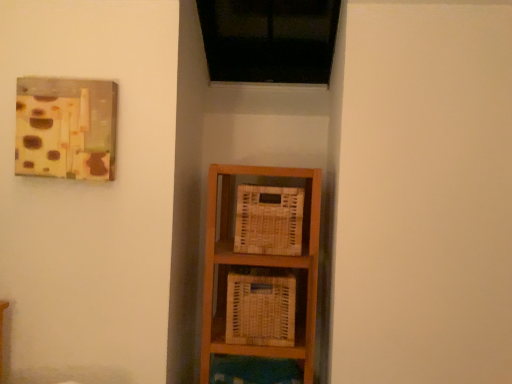
Question: Which direction should I rotate to face woven wood basket at center, placed as the second basket when sorted from bottom to top, — up or down?

Choices:
 (A) down
 (B) up

Answer: (A)

Question: Is woven wood basket at center, placed as the second basket when sorted from bottom to top, not inside white woven basket at center, the second basket viewed from the top?

Choices:
 (A) no
 (B) yes

Answer: (B)

Question: Considering the relative sizes of woven wood basket at center, placed as the second basket when sorted from bottom to top, and white woven basket at center, the 1th basket when ordered from bottom to top, in the image provided, is woven wood basket at center, placed as the second basket when sorted from bottom to top, thinner than white woven basket at center, the 1th basket when ordered from bottom to top,?

Choices:
 (A) yes
 (B) no

Answer: (A)

Question: Is woven wood basket at center, placed as the second basket when sorted from bottom to top, taller than white woven basket at center, the second basket viewed from the top?

Choices:
 (A) yes
 (B) no

Answer: (B)

Question: Is woven wood basket at center, marked as the 1th basket in a top-to-bottom arrangement, bigger than white woven basket at center, the 1th basket when ordered from bottom to top?

Choices:
 (A) no
 (B) yes

Answer: (A)

Question: Is woven wood basket at center, placed as the second basket when sorted from bottom to top, facing away from white woven basket at center, the 1th basket when ordered from bottom to top?

Choices:
 (A) yes
 (B) no

Answer: (B)

Question: Is woven wood basket at center, placed as the second basket when sorted from bottom to top, closer to camera compared to white woven basket at center, the 1th basket when ordered from bottom to top?

Choices:
 (A) no
 (B) yes

Answer: (A)

Question: Is white woven basket at center, the 1th basket when ordered from bottom to top, positioned with its back to woven wood basket at center, placed as the second basket when sorted from bottom to top?

Choices:
 (A) no
 (B) yes

Answer: (A)

Question: Is white woven basket at center, the second basket viewed from the top, facing towards woven wood basket at center, marked as the 1th basket in a top-to-bottom arrangement?

Choices:
 (A) no
 (B) yes

Answer: (A)

Question: Can you confirm if white woven basket at center, the second basket viewed from the top, is positioned to the right of woven wood basket at center, placed as the second basket when sorted from bottom to top?

Choices:
 (A) no
 (B) yes

Answer: (A)

Question: Does white woven basket at center, the second basket viewed from the top, have a lesser height compared to woven wood basket at center, marked as the 1th basket in a top-to-bottom arrangement?

Choices:
 (A) yes
 (B) no

Answer: (B)

Question: Considering the relative sizes of white woven basket at center, the 1th basket when ordered from bottom to top, and woven wood basket at center, placed as the second basket when sorted from bottom to top, in the image provided, is white woven basket at center, the 1th basket when ordered from bottom to top, thinner than woven wood basket at center, placed as the second basket when sorted from bottom to top,?

Choices:
 (A) yes
 (B) no

Answer: (B)

Question: From a real-world perspective, is white woven basket at center, the second basket viewed from the top, on woven wood basket at center, placed as the second basket when sorted from bottom to top?

Choices:
 (A) no
 (B) yes

Answer: (A)

Question: Considering the positions of white woven basket at center, the second basket viewed from the top, and woven wood basket at center, placed as the second basket when sorted from bottom to top, in the image, is white woven basket at center, the second basket viewed from the top, bigger or smaller than woven wood basket at center, placed as the second basket when sorted from bottom to top,?

Choices:
 (A) big
 (B) small

Answer: (A)